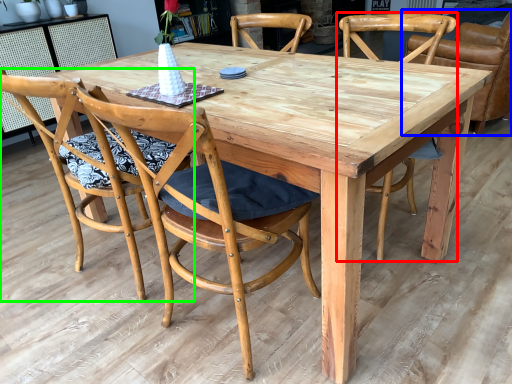
Question: Which is farther away from chair (highlighted by a red box)? chair (highlighted by a blue box) or chair (highlighted by a green box)?

Choices:
 (A) chair
 (B) chair

Answer: (B)